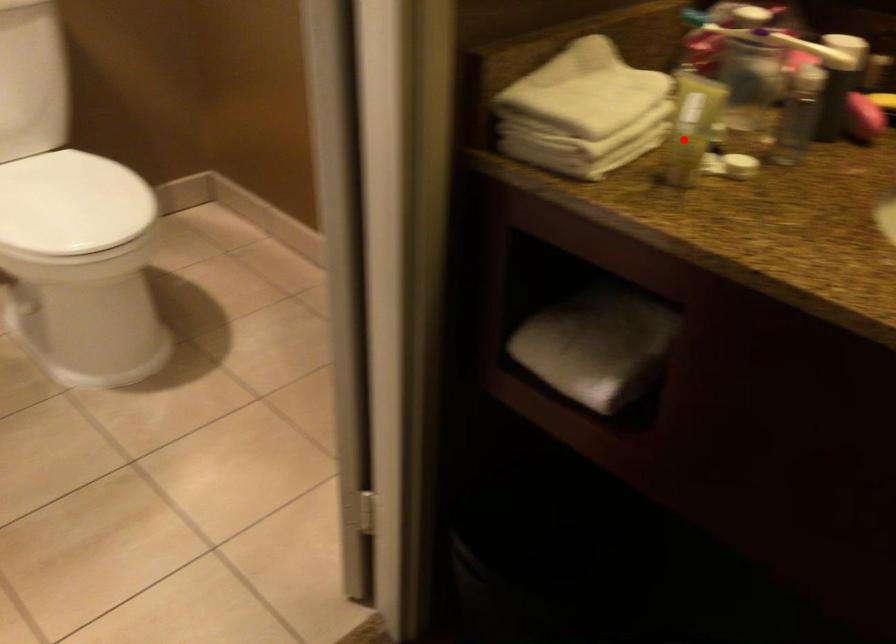
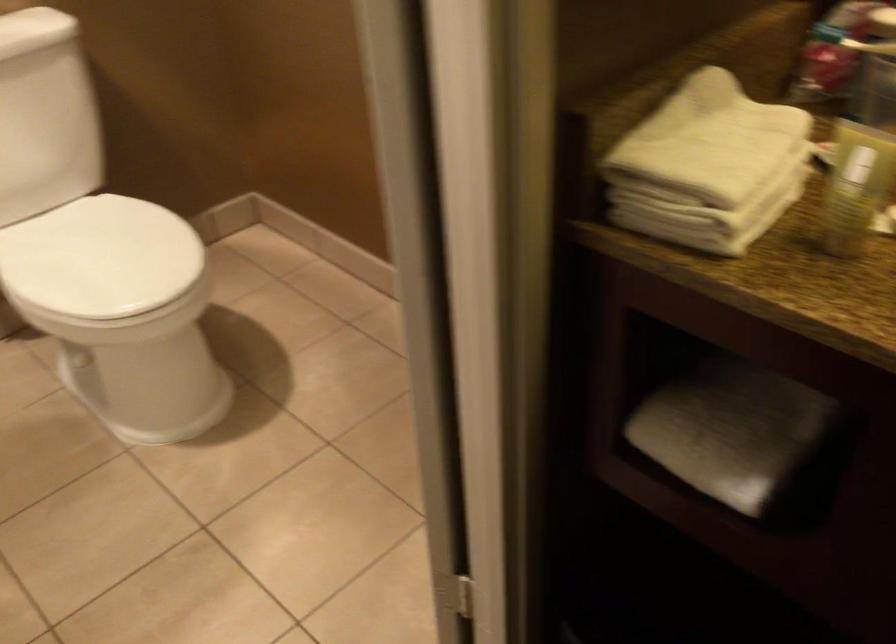
Question: I am providing you with two images of the same scene from different viewpoints. Image1 has a red point marked. In image2, the corresponding 3D location appears at what relative position? Reply with the corresponding letter.

Choices:
 (A) Closer
 (B) Farther

Answer: (A)